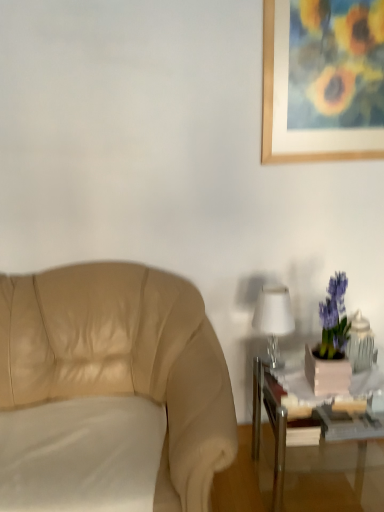
What do you see at coordinates (273, 317) in the screenshot? I see `white glossy table lamp at right` at bounding box center [273, 317].

This screenshot has width=384, height=512. What do you see at coordinates (110, 392) in the screenshot?
I see `beige leather chair at left` at bounding box center [110, 392].

What do you see at coordinates (286, 108) in the screenshot? I see `wooden picture frame at upper right` at bounding box center [286, 108].

Find the location of a particular element. The image size is (384, 512). white fabric pillow at lower left is located at coordinates (81, 455).

From a real-world perspective, is wooden picture frame at upper right under metallic silver table at lower right?

No, from a real-world perspective, wooden picture frame at upper right is not under metallic silver table at lower right.

Which object is wider, wooden picture frame at upper right or metallic silver table at lower right?

With larger width is metallic silver table at lower right.

Looking at this image, are wooden picture frame at upper right and metallic silver table at lower right beside each other?

No.

Is wooden picture frame at upper right taller than beige leather chair at left?

In fact, wooden picture frame at upper right may be shorter than beige leather chair at left.

Is wooden picture frame at upper right beside beige leather chair at left?

No, wooden picture frame at upper right is not next to beige leather chair at left.

Can we say wooden picture frame at upper right lies outside beige leather chair at left?

Indeed, wooden picture frame at upper right is completely outside beige leather chair at left.

Is wooden picture frame at upper right facing towards beige leather chair at left?

No, wooden picture frame at upper right is not aimed at beige leather chair at left.

In the scene shown: Can you confirm if wooden picture frame at upper right is positioned to the right of white glossy table lamp at right?

Indeed, wooden picture frame at upper right is positioned on the right side of white glossy table lamp at right.

From a real-world perspective, is wooden picture frame at upper right physically above white glossy table lamp at right?

Yes, from a real-world perspective, wooden picture frame at upper right is above white glossy table lamp at right.

I want to click on table lamp on the left of wooden picture frame at upper right, so click(273, 317).

Is white fabric pillow at lower left at the back of wooden picture frame at upper right?

No, wooden picture frame at upper right's orientation is not away from white fabric pillow at lower left.

Locate an element on the screen. pillow in front of the wooden picture frame at upper right is located at coordinates (81, 455).

Is wooden picture frame at upper right surrounding white fabric pillow at lower left?

No, wooden picture frame at upper right does not contain white fabric pillow at lower left.

Consider the image. Looking at their sizes, would you say wooden picture frame at upper right is wider or thinner than white fabric pillow at lower left?

Considering their sizes, wooden picture frame at upper right looks slimmer than white fabric pillow at lower left.

In the scene shown: Is white glossy table lamp at right aimed at beige leather chair at left?

No, white glossy table lamp at right is not facing towards beige leather chair at left.

From a real-world perspective, is white glossy table lamp at right physically below beige leather chair at left?

Actually, white glossy table lamp at right is physically above beige leather chair at left in the real world.

In the scene shown: Is white glossy table lamp at right positioned before beige leather chair at left?

No, white glossy table lamp at right is behind beige leather chair at left.

At what (x,y) coordinates should I click in order to perform the action: click on pillow below the beige leather chair at left (from a real-world perspective). Please return your answer as a coordinate pair (x, y). Looking at the image, I should click on (81, 455).

Which of these two, beige leather chair at left or white fabric pillow at lower left, stands taller?

beige leather chair at left.

Which object is more forward, beige leather chair at left or white fabric pillow at lower left?

Positioned in front is beige leather chair at left.

From the picture: From a real-world perspective, which is physically below, beige leather chair at left or white fabric pillow at lower left?

From a 3D spatial view, white fabric pillow at lower left is below.

Is beige leather chair at left inside the boundaries of wooden picture frame at upper right, or outside?

beige leather chair at left cannot be found inside wooden picture frame at upper right.

From a real-world perspective, who is located higher, beige leather chair at left or wooden picture frame at upper right?

wooden picture frame at upper right.

How far apart are beige leather chair at left and wooden picture frame at upper right?

The distance of beige leather chair at left from wooden picture frame at upper right is 3.58 feet.

Does beige leather chair at left have a greater width compared to wooden picture frame at upper right?

Yes, beige leather chair at left is wider than wooden picture frame at upper right.

Identify the location of picture frame on the right of metallic silver table at lower right. The width and height of the screenshot is (384, 512). (286, 108).

At what (x,y) coordinates should I click in order to perform the action: click on chair below the wooden picture frame at upper right (from a real-world perspective). Please return your answer as a coordinate pair (x, y). The height and width of the screenshot is (512, 384). Looking at the image, I should click on (110, 392).

Considering their positions, is beige leather chair at left positioned further to wooden picture frame at upper right than white glossy table lamp at right?

beige leather chair at left is further to wooden picture frame at upper right.

From the image, which object appears to be farther from white glossy table lamp at right, white fabric pillow at lower left or beige leather chair at left?

white fabric pillow at lower left.

Looking at the image, which one is located further to beige leather chair at left, white fabric pillow at lower left or wooden picture frame at upper right?

wooden picture frame at upper right is further to beige leather chair at left.

Looking at the image, which one is located further to white fabric pillow at lower left, white glossy table lamp at right or metallic silver table at lower right?

white glossy table lamp at right is positioned further to the anchor white fabric pillow at lower left.

When comparing their distances from wooden picture frame at upper right, does white fabric pillow at lower left or metallic silver table at lower right seem further?

white fabric pillow at lower left is positioned further to the anchor wooden picture frame at upper right.

Considering their positions, is beige leather chair at left positioned further to wooden picture frame at upper right than white fabric pillow at lower left?

white fabric pillow at lower left is positioned further to the anchor wooden picture frame at upper right.

Looking at the image, which one is located further to white glossy table lamp at right, beige leather chair at left or metallic silver table at lower right?

beige leather chair at left is positioned further to the anchor white glossy table lamp at right.

Which object lies nearer to the anchor point metallic silver table at lower right, wooden picture frame at upper right or beige leather chair at left?

beige leather chair at left is positioned closer to the anchor metallic silver table at lower right.

Locate an element on the screen. The image size is (384, 512). table between beige leather chair at left and white glossy table lamp at right from front to back is located at coordinates (314, 453).

The height and width of the screenshot is (512, 384). In order to click on chair between wooden picture frame at upper right and metallic silver table at lower right in the vertical direction in this screenshot , I will do `click(110, 392)`.

Identify the location of table lamp between wooden picture frame at upper right and white fabric pillow at lower left in the vertical direction. Image resolution: width=384 pixels, height=512 pixels. (273, 317).

Identify the location of chair between wooden picture frame at upper right and white fabric pillow at lower left in the vertical direction. (110, 392).